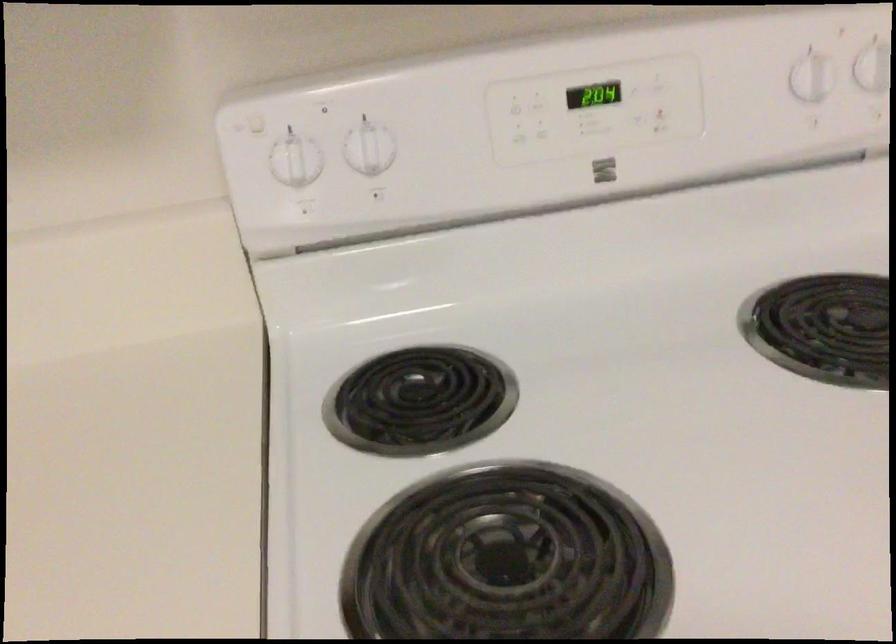
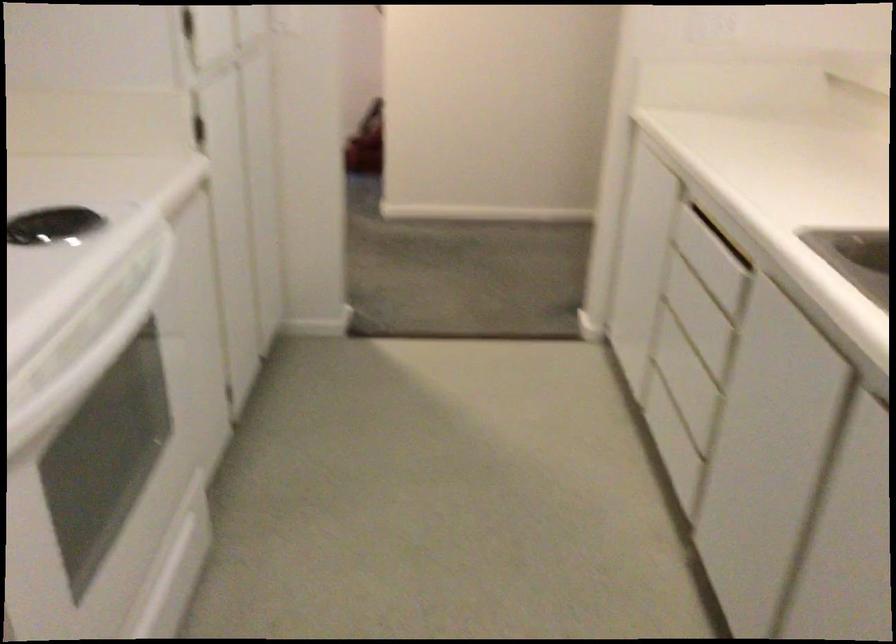
Question: The camera is either moving clockwise (left) or counter-clockwise (right) around the object. The first image is from the beginning of the video and the second image is from the end. Is the camera moving left or right when shooting the video?

Choices:
 (A) Left
 (B) Right

Answer: (A)